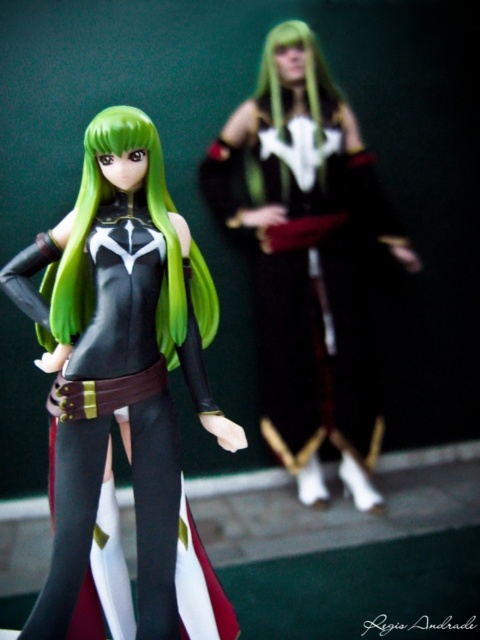
Can you confirm if matte black figure at left is shorter than black matte tights at lower left?

In fact, matte black figure at left may be taller than black matte tights at lower left.

Which is in front, point (144, 180) or point (157, 474)?

Point (157, 474)

You are a GUI agent. You are given a task and a screenshot of the screen. Output one action in this format:
    pyautogui.click(x=<x>, y=<y>)
    Task: Click on the matte black figure at left
    The width and height of the screenshot is (480, 640).
    Given the screenshot: What is the action you would take?
    pyautogui.click(x=122, y=369)

Does matte black figure at left have a greater height compared to matte black dress at upper right?

No.

Between point (168, 593) and point (322, 100), which one is positioned behind?

The point (322, 100) is more distant.

What do you see at coordinates (122, 369) in the screenshot?
I see `matte black figure at left` at bounding box center [122, 369].

Locate an element on the screen. This screenshot has width=480, height=640. matte black figure at left is located at coordinates (122, 369).

What do you see at coordinates (122, 369) in the screenshot? This screenshot has width=480, height=640. I see `matte black figure at left` at bounding box center [122, 369].

Between matte black figure at left and green matte hair at center, which one appears on the left side from the viewer's perspective?

matte black figure at left is more to the left.

The image size is (480, 640). What are the coordinates of `matte black figure at left` in the screenshot? It's located at (122, 369).